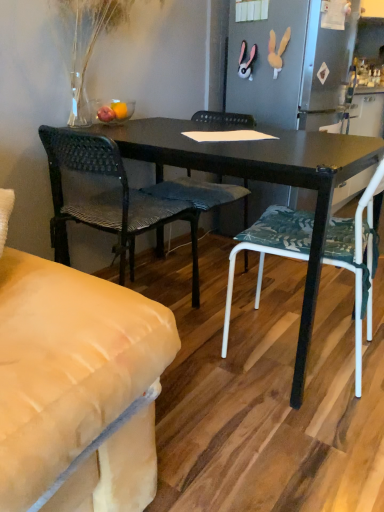
Question: Which direction should I rotate to look at woven fabric chair at center, placed as the second chair when sorted from left to right?

Choices:
 (A) left
 (B) right

Answer: (B)

Question: Does woven fabric chair at center, placed as the second chair when sorted from left to right, have a larger size compared to woven fabric chair at center, which is the 1th chair from left to right?

Choices:
 (A) yes
 (B) no

Answer: (A)

Question: Is woven fabric chair at center, arranged as the 2th chair when viewed from the right, placed right next to woven fabric chair at center, the third chair in the right-to-left sequence?

Choices:
 (A) no
 (B) yes

Answer: (A)

Question: Can you confirm if woven fabric chair at center, arranged as the 2th chair when viewed from the right, is positioned to the left of woven fabric chair at center, the third chair in the right-to-left sequence?

Choices:
 (A) yes
 (B) no

Answer: (B)

Question: Is woven fabric chair at center, which is the 1th chair from left to right, inside woven fabric chair at center, placed as the second chair when sorted from left to right?

Choices:
 (A) yes
 (B) no

Answer: (B)

Question: Can you confirm if woven fabric chair at center, arranged as the 2th chair when viewed from the right, is taller than woven fabric chair at center, which is the 1th chair from left to right?

Choices:
 (A) yes
 (B) no

Answer: (B)

Question: Is woven fabric chair at center, placed as the second chair when sorted from left to right, far from woven fabric chair at center, which is the 1th chair from left to right?

Choices:
 (A) yes
 (B) no

Answer: (B)

Question: Is woven fabric chair at center, placed as the second chair when sorted from left to right, shorter than white fabric chair at center, arranged as the 1th chair when viewed from the right?

Choices:
 (A) no
 (B) yes

Answer: (B)

Question: From the image's perspective, does woven fabric chair at center, placed as the second chair when sorted from left to right, appear lower than white fabric chair at center, arranged as the 1th chair when viewed from the right?

Choices:
 (A) no
 (B) yes

Answer: (A)

Question: Is woven fabric chair at center, placed as the second chair when sorted from left to right, further to camera compared to white fabric chair at center, arranged as the 1th chair when viewed from the right?

Choices:
 (A) yes
 (B) no

Answer: (A)

Question: Is woven fabric chair at center, arranged as the 2th chair when viewed from the right, beside white fabric chair at center, arranged as the 1th chair when viewed from the right?

Choices:
 (A) yes
 (B) no

Answer: (B)

Question: Is woven fabric chair at center, placed as the second chair when sorted from left to right, to the right of white fabric chair at center, arranged as the 1th chair when viewed from the right, from the viewer's perspective?

Choices:
 (A) yes
 (B) no

Answer: (B)

Question: Is there a large distance between woven fabric chair at center, arranged as the 2th chair when viewed from the right, and white fabric chair at center, arranged as the 1th chair when viewed from the right?

Choices:
 (A) no
 (B) yes

Answer: (A)

Question: Can you confirm if white fabric chair at center, arranged as the 3th chair when viewed from the left, is bigger than woven fabric chair at center, arranged as the 2th chair when viewed from the right?

Choices:
 (A) yes
 (B) no

Answer: (A)